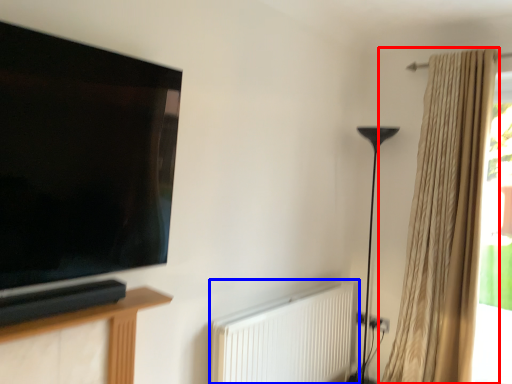
Question: Among these objects, which one is farthest to the camera, curtain (highlighted by a red box) or radiator (highlighted by a blue box)?

Choices:
 (A) curtain
 (B) radiator

Answer: (A)